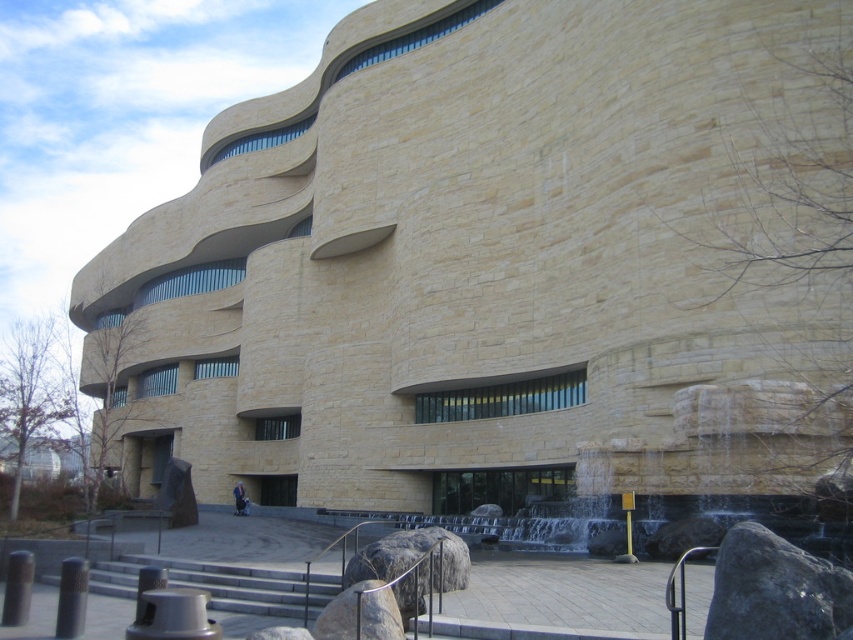
Is metallic gray stairs at lower center to the left of smooth gray rock at lower center from the viewer's perspective?

Indeed, metallic gray stairs at lower center is positioned on the left side of smooth gray rock at lower center.

Is metallic gray stairs at lower center below smooth gray rock at lower center?

Correct, metallic gray stairs at lower center is located below smooth gray rock at lower center.

What do you see at coordinates (209, 582) in the screenshot? Image resolution: width=853 pixels, height=640 pixels. I see `metallic gray stairs at lower center` at bounding box center [209, 582].

Image resolution: width=853 pixels, height=640 pixels. What are the coordinates of `metallic gray stairs at lower center` in the screenshot? It's located at (209, 582).

Between point (764, 588) and point (115, 586), which one is positioned in front?

Point (764, 588)

Can you confirm if dark gray rock at lower right is taller than metallic gray stairs at lower center?

Indeed, dark gray rock at lower right has a greater height compared to metallic gray stairs at lower center.

The image size is (853, 640). I want to click on dark gray rock at lower right, so (x=775, y=589).

Does dark gray rock at lower right appear under smooth gray rock at lower center?

No, dark gray rock at lower right is not below smooth gray rock at lower center.

Who is more distant from viewer, (850, 577) or (349, 593)?

The point (349, 593) is more distant.

The height and width of the screenshot is (640, 853). In order to click on dark gray rock at lower right in this screenshot , I will do `click(775, 589)`.

The height and width of the screenshot is (640, 853). What are the coordinates of `dark gray rock at lower right` in the screenshot? It's located at (775, 589).